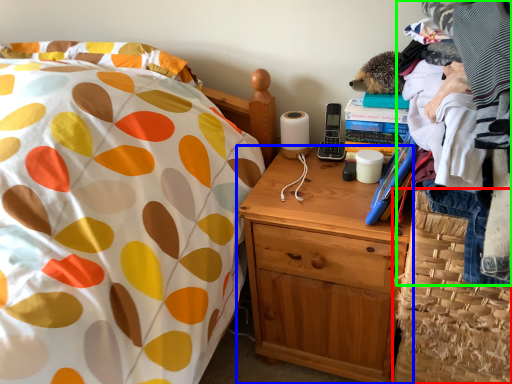
Question: Which object is the closest to the basket (highlighted by a red box)? Choose among these: nightstand (highlighted by a blue box) or clothing (highlighted by a green box).

Choices:
 (A) nightstand
 (B) clothing

Answer: (A)